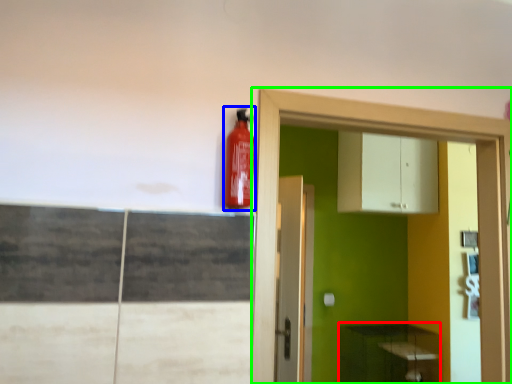
Question: Considering the real-world distances, which object is farthest from cabinetry (highlighted by a red box)? extinguisher (highlighted by a blue box) or dresser (highlighted by a green box)?

Choices:
 (A) extinguisher
 (B) dresser

Answer: (A)